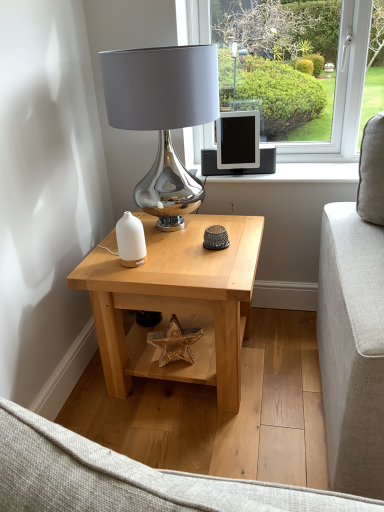
Where is `vacant location below shiny metallic lamp at center (from a real-world perspective)`? vacant location below shiny metallic lamp at center (from a real-world perspective) is located at coordinates (175, 230).